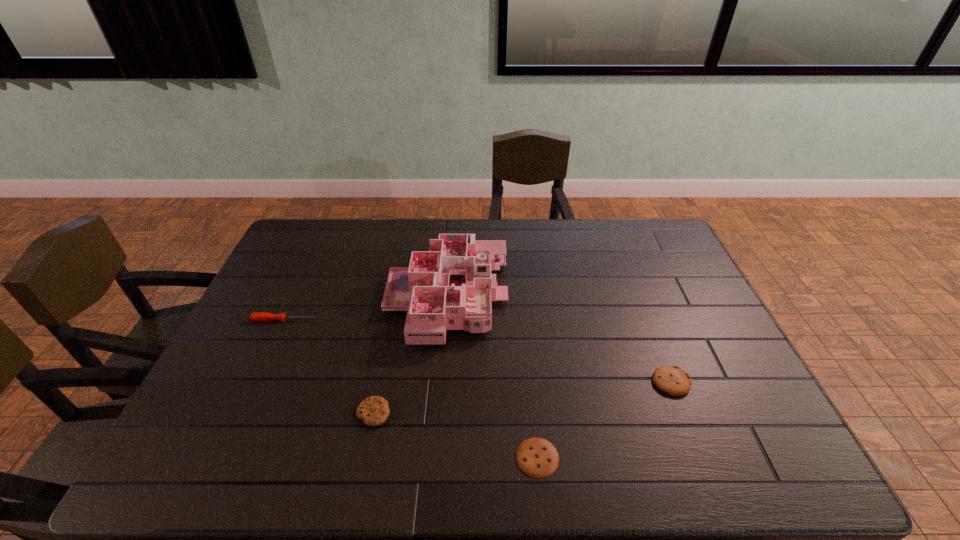
In the image, there is a desktop. At what (x,y) coordinates should I click in order to perform the action: click on vacant space at the right edge. Please return your answer as a coordinate pair (x, y). Image resolution: width=960 pixels, height=540 pixels. Looking at the image, I should click on (756, 413).

You are a GUI agent. You are given a task and a screenshot of the screen. Output one action in this format:
    pyautogui.click(x=<x>, y=<y>)
    Task: Click on the free space between the third farthest object and the leftmost cookie
    
    Given the screenshot: What is the action you would take?
    pyautogui.click(x=522, y=397)

The image size is (960, 540). In order to click on vacant point located between the leftmost object and the leftmost cookie in this screenshot , I will do `click(329, 366)`.

Where is `free spot between the farthest cookie and the second nearest cookie`? The width and height of the screenshot is (960, 540). free spot between the farthest cookie and the second nearest cookie is located at coordinates (522, 397).

I want to click on free space between the second shortest cookie and the rightmost object, so click(x=522, y=397).

Identify the location of vacant point located between the screwdriver and the fourth farthest object. The width and height of the screenshot is (960, 540). (329, 366).

I want to click on vacant space that is in between the third farthest object and the shortest cookie, so click(605, 420).

Image resolution: width=960 pixels, height=540 pixels. Identify the location of free space between the nearest cookie and the second nearest object. (455, 435).

Locate an element on the screen. This screenshot has width=960, height=540. free point between the nearest object and the dollhouse is located at coordinates (492, 377).

At what (x,y) coordinates should I click in order to perform the action: click on vacant area between the nearest cookie and the leftmost object. Please return your answer as a coordinate pair (x, y). The height and width of the screenshot is (540, 960). Looking at the image, I should click on (411, 389).